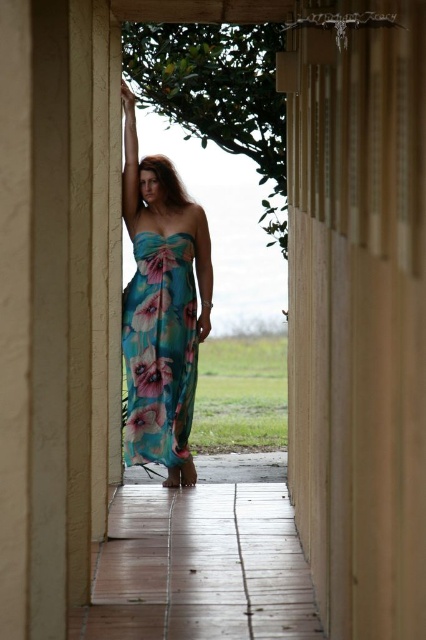
Between floral chiffon dress at center and floral print fabric dress at center, which one appears on the right side from the viewer's perspective?

floral chiffon dress at center is more to the right.

Who is higher up, floral chiffon dress at center or floral print fabric dress at center?

floral chiffon dress at center is above.

Is point (164, 186) positioned after point (183, 412)?

Yes.

Find the location of a particular element. The width and height of the screenshot is (426, 640). floral chiffon dress at center is located at coordinates (161, 308).